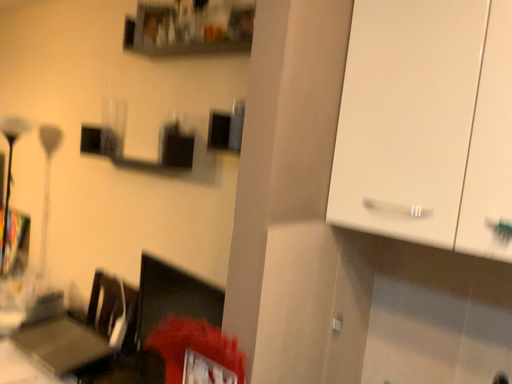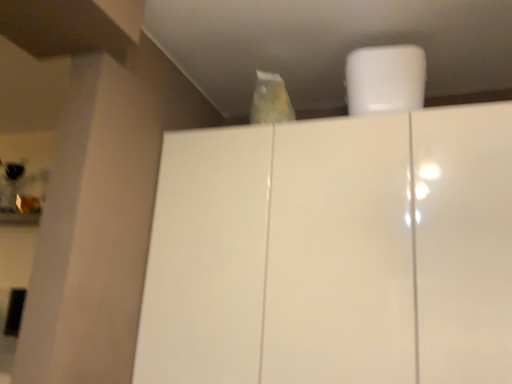
Question: How did the camera likely rotate when shooting the video?

Choices:
 (A) rotated downward
 (B) rotated upward

Answer: (B)